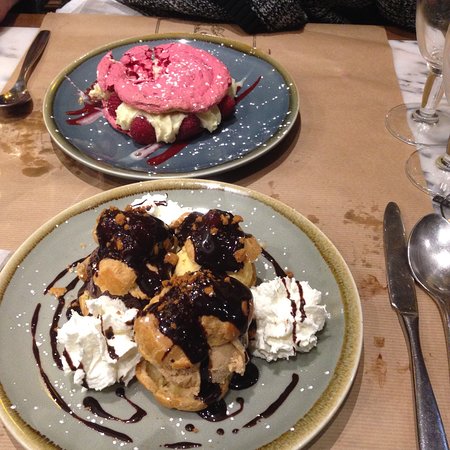
Locate an element on the screen. glass is located at coordinates (413, 128).